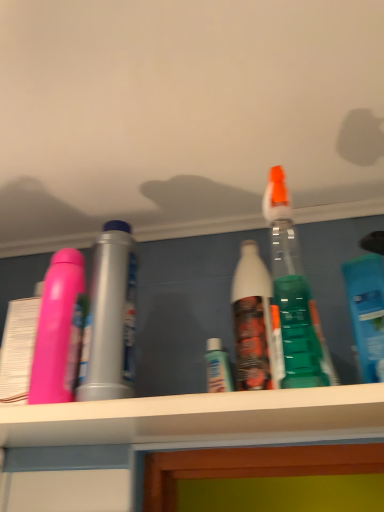
What is the approximate height of pink matte bottle at left, the 2th bottle in the right-to-left sequence?

pink matte bottle at left, the 2th bottle in the right-to-left sequence, is 11.37 inches in height.

What do you see at coordinates (110, 318) in the screenshot? I see `pink matte bottle at left, the 2th bottle in the right-to-left sequence` at bounding box center [110, 318].

Measure the distance between pink matte bottle at left, the 2th bottle in the right-to-left sequence, and camera.

pink matte bottle at left, the 2th bottle in the right-to-left sequence, and camera are 47.63 centimeters apart.

Where is `pink matte bottle at left, the 1th bottle when ordered from left to right`? pink matte bottle at left, the 1th bottle when ordered from left to right is located at coordinates (110, 318).

What is the approximate width of blue translucent bottle at right, the 1th bottle positioned from the right?

blue translucent bottle at right, the 1th bottle positioned from the right, is 2.57 inches in width.

Where is `blue translucent bottle at right, the 1th bottle positioned from the right`? The width and height of the screenshot is (384, 512). blue translucent bottle at right, the 1th bottle positioned from the right is located at coordinates [x=367, y=305].

This screenshot has height=512, width=384. What do you see at coordinates (367, 305) in the screenshot?
I see `blue translucent bottle at right, the second bottle from the left` at bounding box center [367, 305].

What is the approximate height of blue translucent bottle at right, the second bottle from the left?

blue translucent bottle at right, the second bottle from the left, is 7.47 inches tall.

Identify the location of pink matte bottle at left, the 2th bottle in the right-to-left sequence. (110, 318).

Would you say blue translucent bottle at right, the 1th bottle positioned from the right, is to the left or to the right of pink matte bottle at left, the 2th bottle in the right-to-left sequence, in the picture?

blue translucent bottle at right, the 1th bottle positioned from the right, is to the right of pink matte bottle at left, the 2th bottle in the right-to-left sequence.

Considering their positions, is blue translucent bottle at right, the second bottle from the left, located in front of or behind pink matte bottle at left, the 2th bottle in the right-to-left sequence?

Visually, blue translucent bottle at right, the second bottle from the left, is located in front of pink matte bottle at left, the 2th bottle in the right-to-left sequence.

Is point (356, 284) positioned in front of point (108, 239)?

No, (356, 284) is behind (108, 239).

From the image's perspective, relative to pink matte bottle at left, the 2th bottle in the right-to-left sequence, is blue translucent bottle at right, the 1th bottle positioned from the right, above or below?

From the image's perspective, blue translucent bottle at right, the 1th bottle positioned from the right, appears above pink matte bottle at left, the 2th bottle in the right-to-left sequence.

From a real-world perspective, who is located lower, blue translucent bottle at right, the second bottle from the left, or pink matte bottle at left, the 2th bottle in the right-to-left sequence?

blue translucent bottle at right, the second bottle from the left, from a real-world perspective.

Looking at this image, considering the sizes of objects blue translucent bottle at right, the second bottle from the left, and pink matte bottle at left, the 1th bottle when ordered from left to right, in the image provided, who is wider, blue translucent bottle at right, the second bottle from the left, or pink matte bottle at left, the 1th bottle when ordered from left to right,?

With larger width is blue translucent bottle at right, the second bottle from the left.

Does blue translucent bottle at right, the second bottle from the left, have a lesser height compared to pink matte bottle at left, the 2th bottle in the right-to-left sequence?

Indeed, blue translucent bottle at right, the second bottle from the left, has a lesser height compared to pink matte bottle at left, the 2th bottle in the right-to-left sequence.

Who is bigger, blue translucent bottle at right, the second bottle from the left, or pink matte bottle at left, the 1th bottle when ordered from left to right?

blue translucent bottle at right, the second bottle from the left, is bigger.

Could pink matte bottle at left, the 1th bottle when ordered from left to right, be considered to be inside blue translucent bottle at right, the second bottle from the left?

Definitely not — pink matte bottle at left, the 1th bottle when ordered from left to right, is not inside blue translucent bottle at right, the second bottle from the left.

Is blue translucent bottle at right, the second bottle from the left, next to pink matte bottle at left, the 1th bottle when ordered from left to right?

blue translucent bottle at right, the second bottle from the left, and pink matte bottle at left, the 1th bottle when ordered from left to right, are clearly separated.

Is blue translucent bottle at right, the 1th bottle positioned from the right, oriented away from pink matte bottle at left, the 1th bottle when ordered from left to right?

No.

How different are the orientations of blue translucent bottle at right, the second bottle from the left, and pink matte bottle at left, the 1th bottle when ordered from left to right, in degrees?

blue translucent bottle at right, the second bottle from the left, and pink matte bottle at left, the 1th bottle when ordered from left to right, are facing 3.27 degrees away from each other.

Could you measure the distance between blue translucent bottle at right, the 1th bottle positioned from the right, and pink matte bottle at left, the 1th bottle when ordered from left to right?

They are 14.18 inches apart.

The width and height of the screenshot is (384, 512). Identify the location of bottle behind the blue translucent bottle at right, the second bottle from the left. (110, 318).

Visually, is pink matte bottle at left, the 2th bottle in the right-to-left sequence, positioned to the left or to the right of blue translucent bottle at right, the second bottle from the left?

pink matte bottle at left, the 2th bottle in the right-to-left sequence, is to the left of blue translucent bottle at right, the second bottle from the left.

Is pink matte bottle at left, the 2th bottle in the right-to-left sequence, further to the viewer compared to blue translucent bottle at right, the 1th bottle positioned from the right?

Yes, it is behind blue translucent bottle at right, the 1th bottle positioned from the right.

Which is nearer, (98, 324) or (362, 289)?

Clearly, point (98, 324) is closer to the camera than point (362, 289).

From the image's perspective, is pink matte bottle at left, the 1th bottle when ordered from left to right, located above or below blue translucent bottle at right, the 1th bottle positioned from the right?

Based on their image positions, pink matte bottle at left, the 1th bottle when ordered from left to right, is located beneath blue translucent bottle at right, the 1th bottle positioned from the right.

From a real-world perspective, does pink matte bottle at left, the 1th bottle when ordered from left to right, stand above blue translucent bottle at right, the 1th bottle positioned from the right?

Correct, in the physical world, pink matte bottle at left, the 1th bottle when ordered from left to right, is higher than blue translucent bottle at right, the 1th bottle positioned from the right.

Which of these two, pink matte bottle at left, the 1th bottle when ordered from left to right, or blue translucent bottle at right, the second bottle from the left, is wider?

blue translucent bottle at right, the second bottle from the left.

Considering the sizes of objects pink matte bottle at left, the 2th bottle in the right-to-left sequence, and blue translucent bottle at right, the second bottle from the left, in the image provided, who is taller, pink matte bottle at left, the 2th bottle in the right-to-left sequence, or blue translucent bottle at right, the second bottle from the left,?

pink matte bottle at left, the 2th bottle in the right-to-left sequence.

Considering the sizes of objects pink matte bottle at left, the 1th bottle when ordered from left to right, and blue translucent bottle at right, the 1th bottle positioned from the right, in the image provided, who is bigger, pink matte bottle at left, the 1th bottle when ordered from left to right, or blue translucent bottle at right, the 1th bottle positioned from the right,?

Bigger between the two is blue translucent bottle at right, the 1th bottle positioned from the right.

Could blue translucent bottle at right, the 1th bottle positioned from the right, be considered to be inside pink matte bottle at left, the 2th bottle in the right-to-left sequence?

No.

Is pink matte bottle at left, the 1th bottle when ordered from left to right, far from blue translucent bottle at right, the second bottle from the left?

No, pink matte bottle at left, the 1th bottle when ordered from left to right, is not far from blue translucent bottle at right, the second bottle from the left.

In the scene shown: Is pink matte bottle at left, the 1th bottle when ordered from left to right, looking in the opposite direction of blue translucent bottle at right, the 1th bottle positioned from the right?

That's not correct — pink matte bottle at left, the 1th bottle when ordered from left to right, is not looking away from blue translucent bottle at right, the 1th bottle positioned from the right.

Locate an element on the screen. bottle above the blue translucent bottle at right, the second bottle from the left (from a real-world perspective) is located at coordinates (110, 318).

You are a GUI agent. You are given a task and a screenshot of the screen. Output one action in this format:
    pyautogui.click(x=<x>, y=<y>)
    Task: Click on the bottle in front of the pink matte bottle at left, the 2th bottle in the right-to-left sequence
    The width and height of the screenshot is (384, 512).
    Given the screenshot: What is the action you would take?
    pyautogui.click(x=367, y=305)

This screenshot has width=384, height=512. I want to click on bottle that is under the pink matte bottle at left, the 2th bottle in the right-to-left sequence (from a real-world perspective), so click(x=367, y=305).